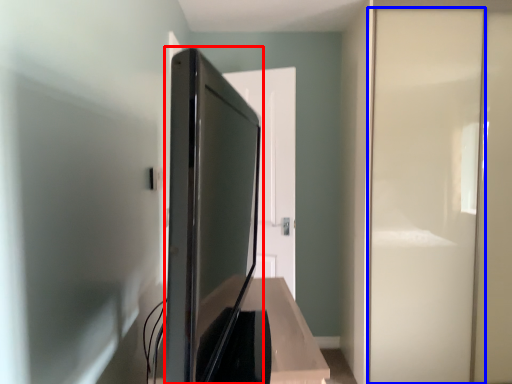
Question: Among these objects, which one is nearest to the camera, appliance (highlighted by a red box) or screen door (highlighted by a blue box)?

Choices:
 (A) appliance
 (B) screen door

Answer: (A)